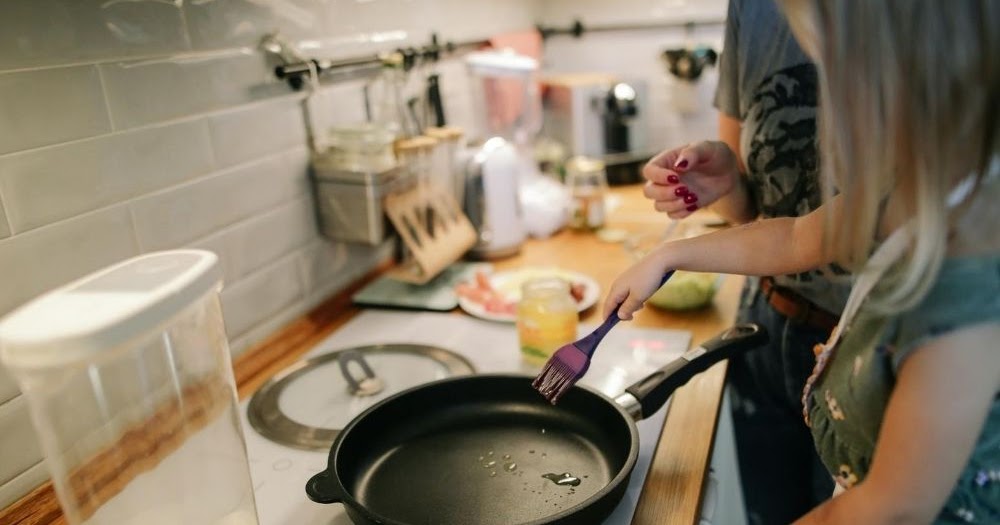
Identify the location of towel. (520, 38).